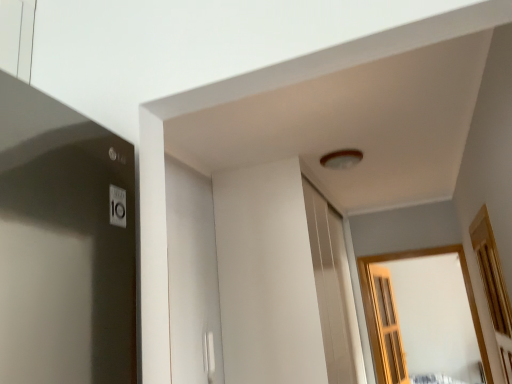
Question: Considering the positions of wooden screen door at right and wooden at right, placed as the first window when sorted from front to back, in the image, is wooden screen door at right wider or thinner than wooden at right, placed as the first window when sorted from front to back,?

Choices:
 (A) wide
 (B) thin

Answer: (A)

Question: Looking at the image, does wooden screen door at right seem bigger or smaller compared to wooden at right, placed as the first window when sorted from front to back?

Choices:
 (A) big
 (B) small

Answer: (A)

Question: Considering the real-world distances, which object is farthest from the wooden-framed window at center, the 2th window positioned from the front?

Choices:
 (A) wooden screen door at right
 (B) wooden at right, placed as the first window when sorted from front to back

Answer: (B)

Question: Estimate the real-world distances between objects in this image. Which object is closer to the wooden-framed window at center, the 2th window positioned from the front?

Choices:
 (A) wooden at right, placed as the first window when sorted from front to back
 (B) wooden screen door at right

Answer: (B)